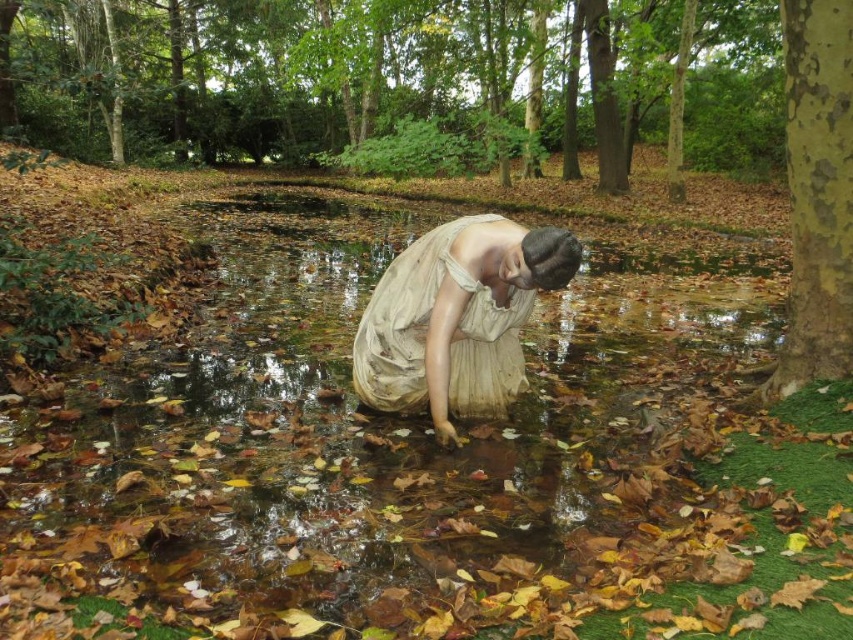
You are standing at the edge of the small, shallow pond in the park. You notice a point marked at coordinates (372,444). What is located at that point?

The point at coordinates (372,444) indicates clear water at center.

You are a photographer planning to take a picture of the clear water at center and the matte white dress at center in the autumn scene. Which object should you focus on first if you want to capture both in a single shot without moving the camera?

You should focus on the clear water at center first because it is larger in size than the matte white dress at center, making it the dominant subject in the frame.